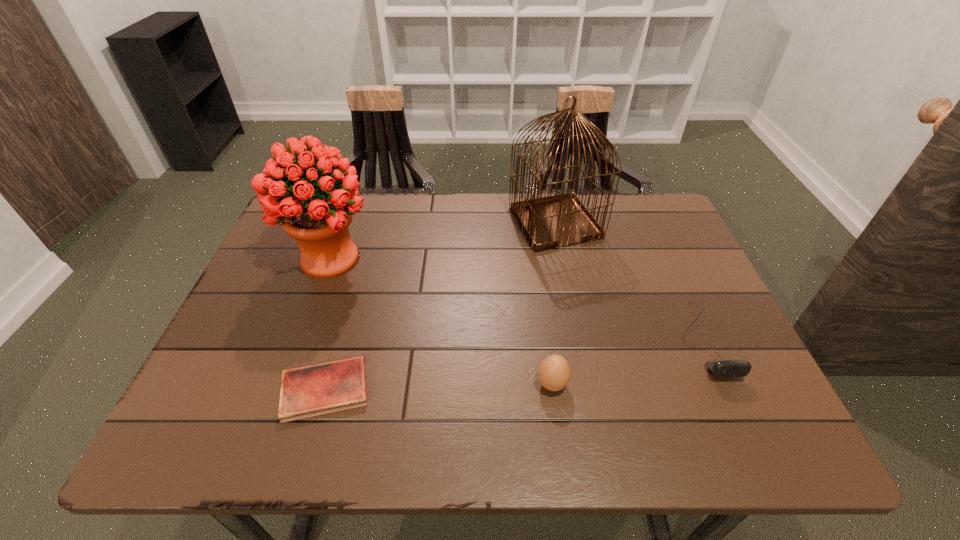
You are a GUI agent. You are given a task and a screenshot of the screen. Output one action in this format:
    pyautogui.click(x=<x>, y=<y>)
    Task: Click on the birdcage
    Image resolution: width=960 pixels, height=540 pixels.
    Given the screenshot: What is the action you would take?
    pyautogui.click(x=547, y=222)

At what (x,y) coordinates should I click in order to perform the action: click on bouquet. Please return your answer as a coordinate pair (x, y). The image size is (960, 540). Looking at the image, I should click on (293, 191).

Image resolution: width=960 pixels, height=540 pixels. What are the coordinates of `the third tallest object` in the screenshot? It's located at (554, 372).

Image resolution: width=960 pixels, height=540 pixels. I want to click on webcam, so click(x=725, y=368).

Identify the location of the fourth tallest object. This screenshot has width=960, height=540. (725, 368).

Where is `the shortest object`? The width and height of the screenshot is (960, 540). the shortest object is located at coordinates (319, 389).

Find the location of a particular element. This screenshot has height=540, width=960. vacant space located on the front of the birdcage is located at coordinates (568, 293).

In order to click on vacant point located on the front of the bouquet in this screenshot , I will do `click(276, 407)`.

Where is `vacant space located 0.170m on the left of the boiled egg`? The image size is (960, 540). vacant space located 0.170m on the left of the boiled egg is located at coordinates (453, 384).

Where is `free spot located on the front-facing side of the rightmost object`? This screenshot has height=540, width=960. free spot located on the front-facing side of the rightmost object is located at coordinates (734, 409).